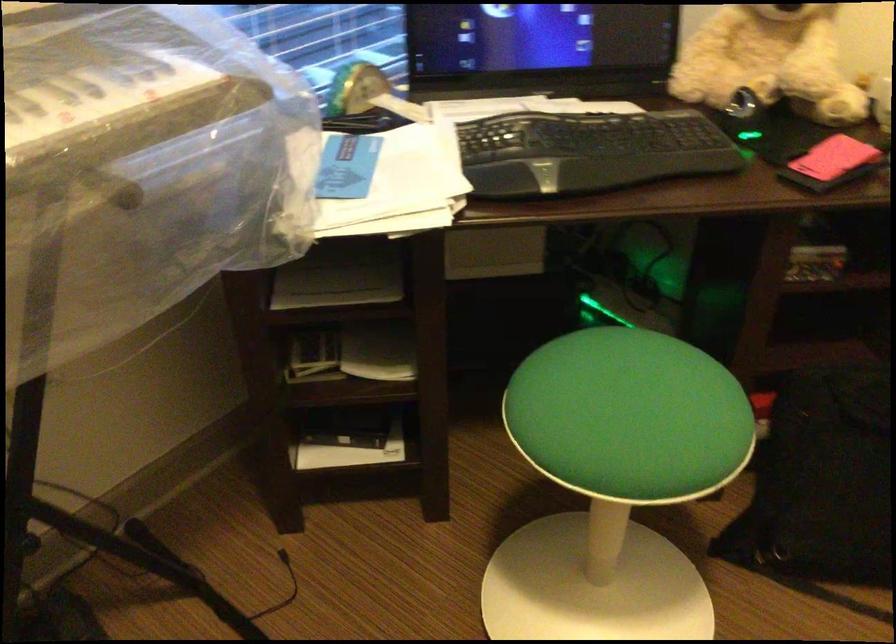
Identify the location of green chair sitting surface. The width and height of the screenshot is (896, 644). (629, 415).